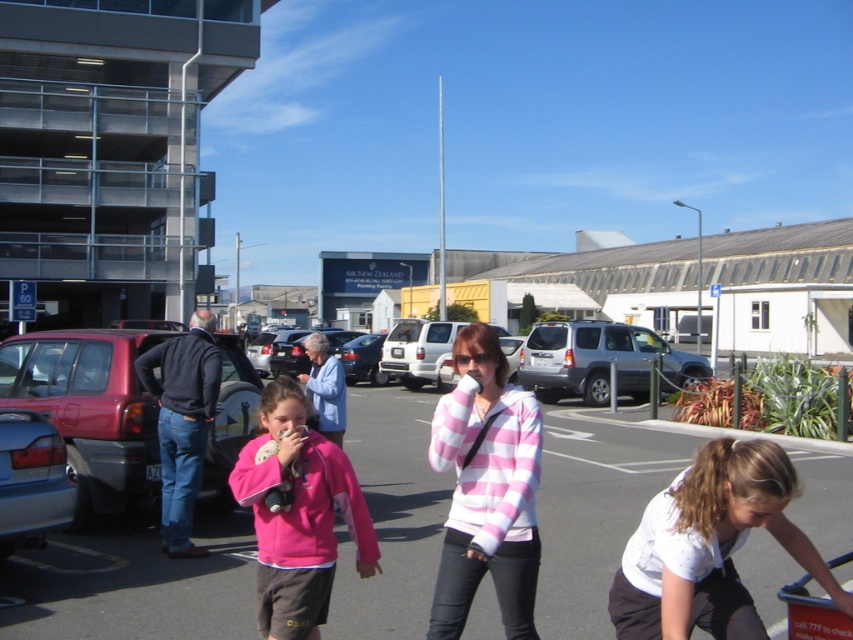
You are standing in the parking lot and want to find the pink striped sweater at center. According to the coordinates given, where would you look relative to the other people in the scene?

The pink striped sweater at center is located at coordinates point (x=486, y=488), which places it at the center of the scene. Since the two children and the adult woman are all positioned in the foreground, the pink striped sweater at center would be centrally located among them.

You are a clothing designer observing the scene. You notice the pink striped sweater at center and the pink fleece jacket at center. Which of these two items appears to be more slender in design?

The pink striped sweater at center is thinner than the pink fleece jacket at center, so the pink striped sweater at center appears more slender in design.